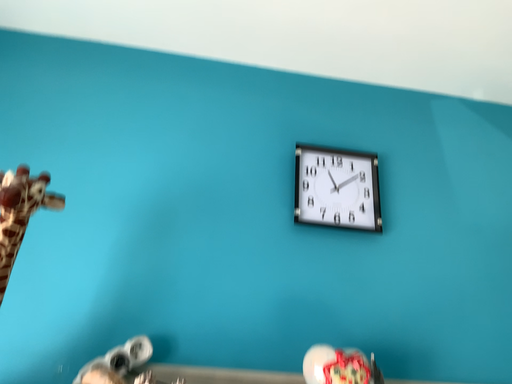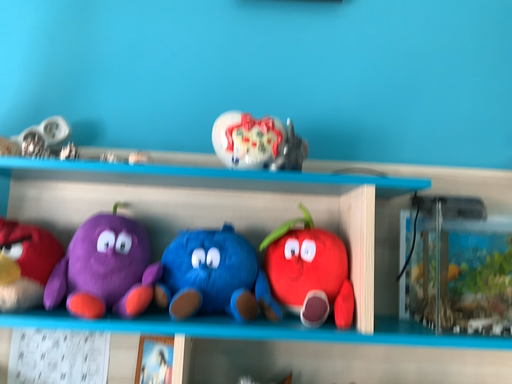
Question: How did the camera likely rotate when shooting the video?

Choices:
 (A) rotated upward
 (B) rotated downward

Answer: (B)